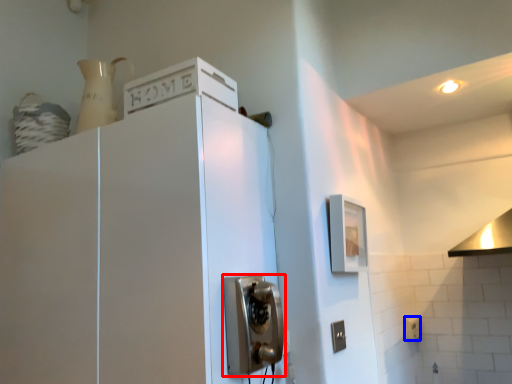
Question: Among these objects, which one is nearest to the camera, door handle (highlighted by a red box) or electric outlet (highlighted by a blue box)?

Choices:
 (A) door handle
 (B) electric outlet

Answer: (A)